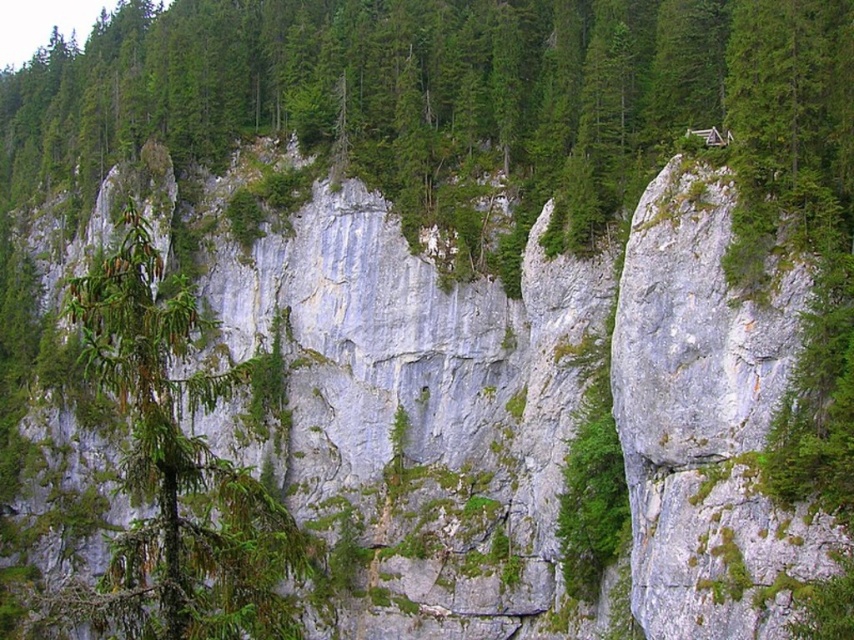
You are a hiker standing at the base of the cliff and looking upward. Which of the two green matte trees do you see first as you look up? The green matte tree at center or the green matte tree at left?

The green matte tree at center is wider than the green matte tree at left, so you would see the green matte tree at center first because its larger size makes it more prominent in your line of sight.

You are a hiker who wants to navigate between the two green matte trees. Which direction should you go from the green matte tree at left to reach the green matte tree at center?

To reach the green matte tree at center from the green matte tree at left, you should go to the right since the green matte tree at center is to the left of the green matte tree at left.